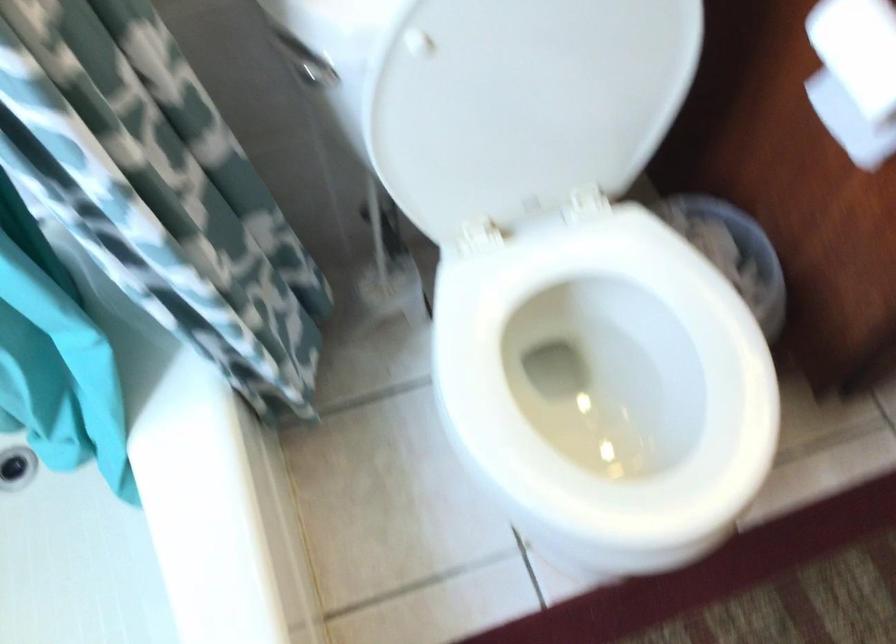
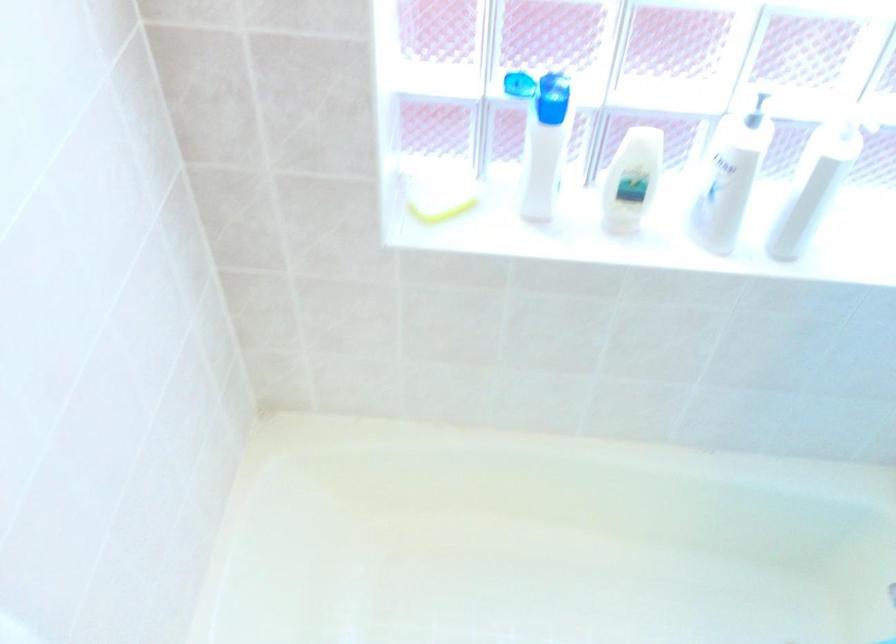
The first image is from the beginning of the video and the second image is from the end. How did the camera likely rotate when shooting the video?

The camera rotated toward left-down.